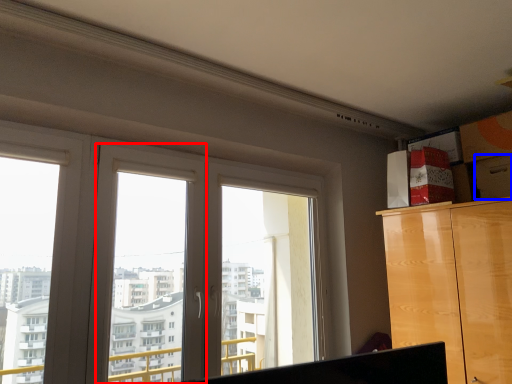
Question: Among these objects, which one is nearest to the camera, window frame (highlighted by a red box) or drawer (highlighted by a blue box)?

Choices:
 (A) window frame
 (B) drawer

Answer: (A)